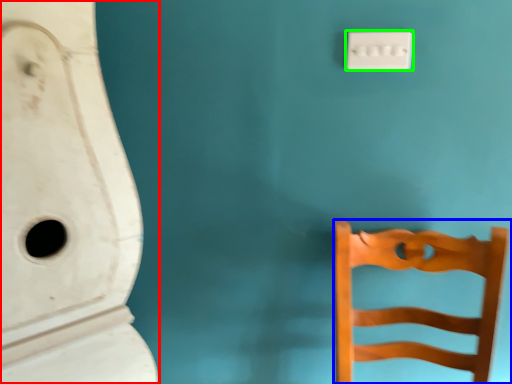
Question: Based on their relative distances, which object is nearer to urinal (highlighted by a red box)? Choose from furniture (highlighted by a blue box) and light switch (highlighted by a green box).

Choices:
 (A) furniture
 (B) light switch

Answer: (A)